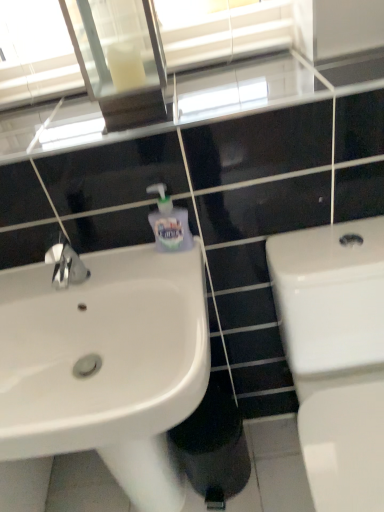
Question: Does point (370, 269) appear closer or farther from the camera than point (99, 283)?

Choices:
 (A) closer
 (B) farther

Answer: (A)

Question: Looking at their shapes, would you say white glossy toilet at right is wider or thinner than white glossy sink at left?

Choices:
 (A) wide
 (B) thin

Answer: (A)

Question: Which object is positioned closest to the translucent plastic soap dispenser at upper center?

Choices:
 (A) white glossy sink at left
 (B) clear glass mirror at upper center
 (C) white glossy toilet at right

Answer: (A)

Question: Which of these objects is positioned farthest from the white glossy sink at left?

Choices:
 (A) clear glass mirror at upper center
 (B) translucent plastic soap dispenser at upper center
 (C) white glossy toilet at right

Answer: (A)